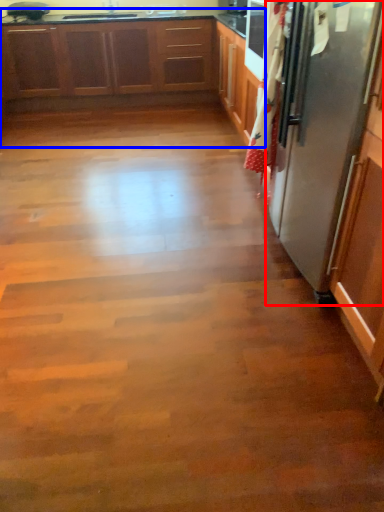
Question: Which point is closer to the camera, refrigerator (highlighted by a red box) or cabinetry (highlighted by a blue box)?

Choices:
 (A) refrigerator
 (B) cabinetry

Answer: (A)